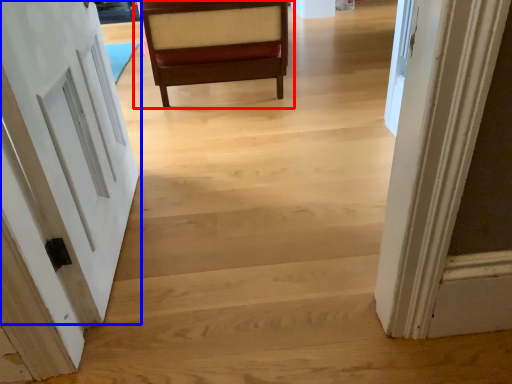
Question: Which object appears farthest to the camera in this image, chair (highlighted by a red box) or door (highlighted by a blue box)?

Choices:
 (A) chair
 (B) door

Answer: (A)